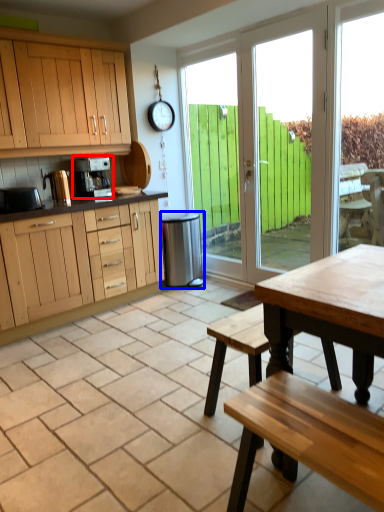
Question: Which point is closer to the camera, coffee maker (highlighted by a red box) or appliance (highlighted by a blue box)?

Choices:
 (A) coffee maker
 (B) appliance

Answer: (A)